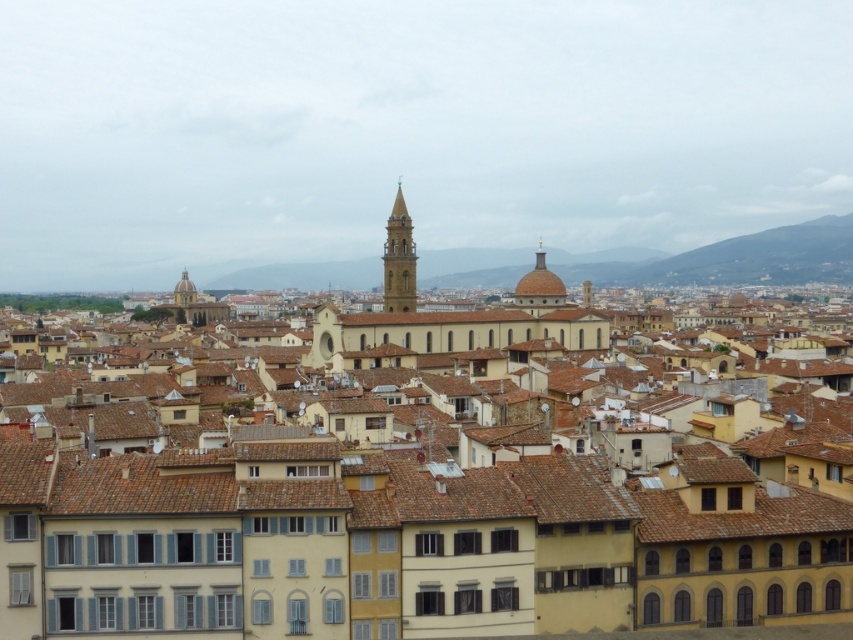
Consider the image. You are an architect visiting this historic city. You notice the yellow matte building at center and the matte gold dome at upper left. Which structure is positioned lower in the image?

The yellow matte building at center is located below the matte gold dome at upper left, so it is positioned lower in the image.

You are an architect analyzing the spatial relationships in this historic cityscape. Which dome, the golden dome at center or the matte gold dome at upper left, appears closer to you based on their positions in the scene?

The golden dome at center appears closer to you because it is positioned in front of the matte gold dome at upper left.